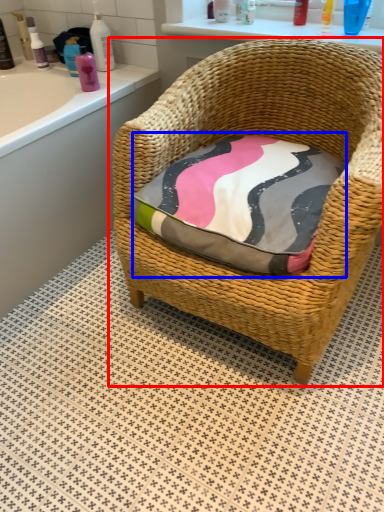
Question: Which point is further to the camera, chair (highlighted by a red box) or throw pillow (highlighted by a blue box)?

Choices:
 (A) chair
 (B) throw pillow

Answer: (B)